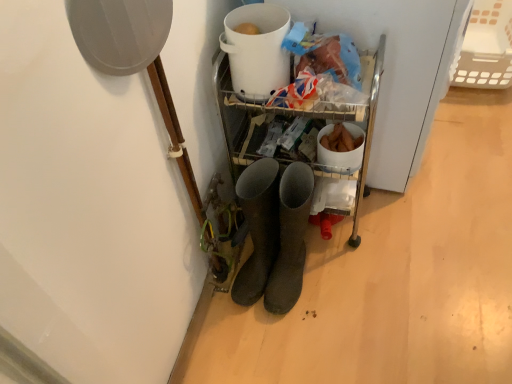
Question: Is white plastic basket at upper right next to white plastic bucket at upper center and touching it?

Choices:
 (A) no
 (B) yes

Answer: (A)

Question: Is white plastic basket at upper right bigger than white plastic bucket at upper center?

Choices:
 (A) no
 (B) yes

Answer: (B)

Question: Is white plastic bucket at upper center inside white plastic basket at upper right?

Choices:
 (A) yes
 (B) no

Answer: (B)

Question: Does white plastic basket at upper right have a smaller size compared to white plastic bucket at upper center?

Choices:
 (A) no
 (B) yes

Answer: (A)

Question: Does white plastic basket at upper right appear on the left side of white plastic bucket at upper center?

Choices:
 (A) yes
 (B) no

Answer: (B)

Question: Is white plastic basket at upper right closer to the viewer compared to white plastic bucket at upper center?

Choices:
 (A) yes
 (B) no

Answer: (B)

Question: Considering the relative sizes of dark gray rubber boots at center and white plastic basket at upper right in the image provided, is dark gray rubber boots at center bigger than white plastic basket at upper right?

Choices:
 (A) no
 (B) yes

Answer: (A)

Question: Does dark gray rubber boots at center appear on the right side of white plastic basket at upper right?

Choices:
 (A) no
 (B) yes

Answer: (A)

Question: Considering the relative positions of dark gray rubber boots at center and white plastic basket at upper right in the image provided, is dark gray rubber boots at center behind white plastic basket at upper right?

Choices:
 (A) no
 (B) yes

Answer: (A)

Question: Can you confirm if dark gray rubber boots at center is smaller than white plastic basket at upper right?

Choices:
 (A) yes
 (B) no

Answer: (A)

Question: Is dark gray rubber boots at center not within white plastic basket at upper right?

Choices:
 (A) no
 (B) yes

Answer: (B)

Question: Is white plastic basket at upper right located within dark gray rubber boots at center?

Choices:
 (A) yes
 (B) no

Answer: (B)

Question: Does white plastic basket at upper right have a greater height compared to dark gray rubber boots at center?

Choices:
 (A) no
 (B) yes

Answer: (A)